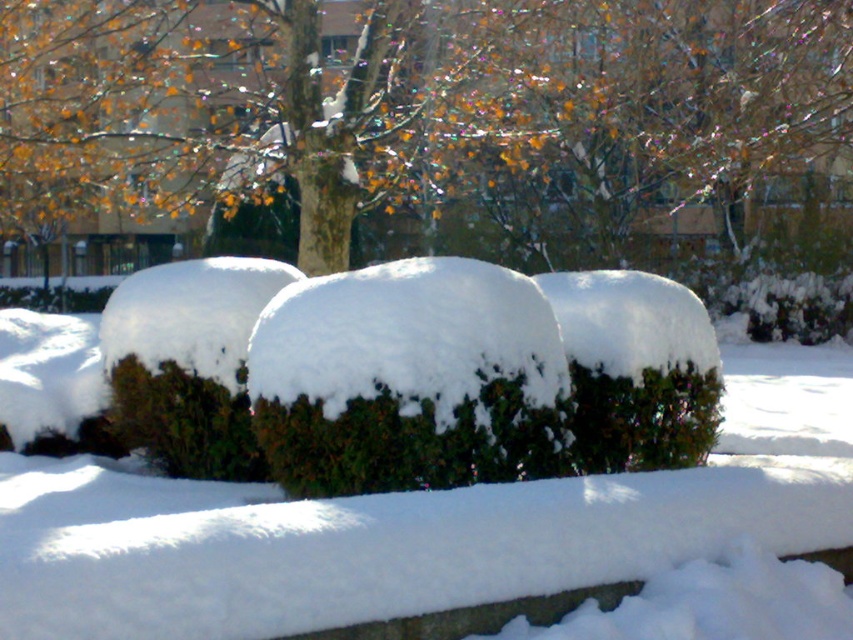
You are a bird looking for a place to perch. You see the green leafy tree at center and the green matte bush at center. Which one is taller?

The green leafy tree at center is taller than the green matte bush at center, so the bird should choose the green leafy tree at center for perching.

You are standing in the winter park scene. You see a green leafy tree at center and a green matte bush at center. Which object is positioned higher in the image?

The green leafy tree at center is above the green matte bush at center, so it is positioned higher in the image.

Looking at this image, you are standing in the winter park scene and want to walk from the green leafy tree at center to the green matte bush at center. Which direction should you move to reach the bush?

To reach the green matte bush at center from the green leafy tree at center, you should move to the left since the green leafy tree at center is positioned to the right of the green matte bush at center.